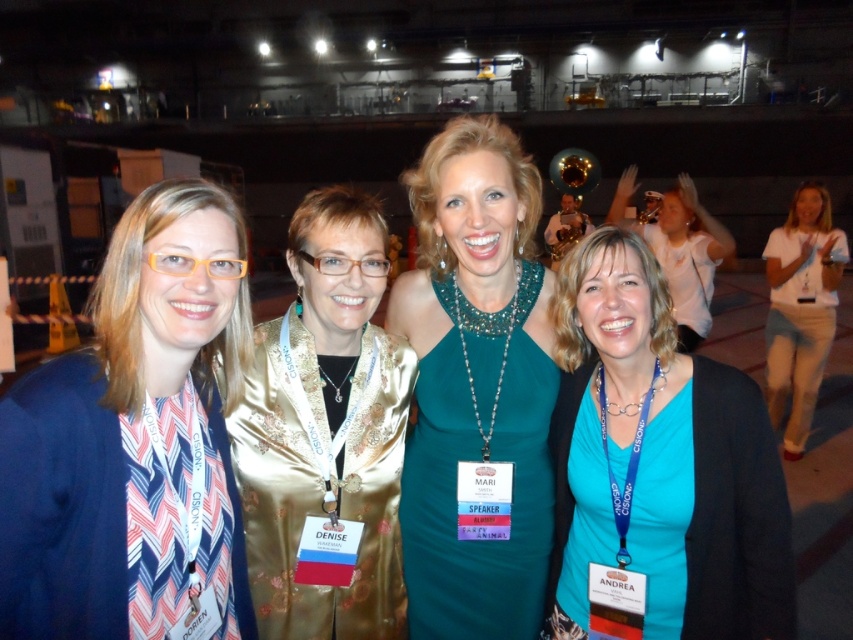
You are a photographer trying to capture a clear shot of both the teal matte shirt at center and the white cotton shirt at right. Since you want both subjects to be in focus, which one should you focus on first to ensure depth of field covers both?

You should focus on the teal matte shirt at center first because it is closer to the viewer. By focusing on the closer subject, the depth of field will extend backward, covering the white cotton shirt at right which is farther away.

You are a photographer standing at the front of the stage. You want to take a closeup photo of the gold satin blouse at center without moving the subject. Can you get a clear closeup shot using a standard camera lens with a maximum focal length of 200mm? Explain your reasoning.

The gold satin blouse at center is 1.75 meters from the camera. With a standard camera lens of 200mm focal length, this distance allows for a clear closeup shot since the subject is within a typical focusing range and the focal length is sufficient for capturing details at that proximity.

You are organizing a photo shoot and need to arrange two outfits on a mannequin stand. The stand can only accommodate items with a combined width of 1.2 meters. If you place the gold satin blouse at center and the teal satin dress at lower right side by side, will their combined width exceed the stand capacity?

The gold satin blouse at center has a larger width than the teal satin dress at lower right. Since the exact widths aren not provided, but the combined width must be under 1.2 meters, it depends on their individual measurements. However, since the gold satin blouse is wider, if its width alone is over 0.6 meters, the total might exceed. Without specific measurements, we can only say that if both are within 1.2 meters combined, it would work, but the question states the gold is wider, so if the total is over